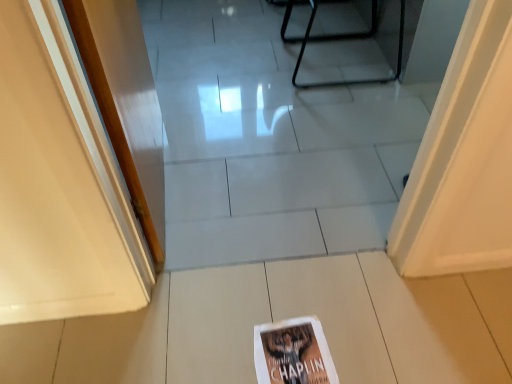
Find the location of a particular element. free spot above white paper book at center (from a real-world perspective) is located at coordinates tap(292, 353).